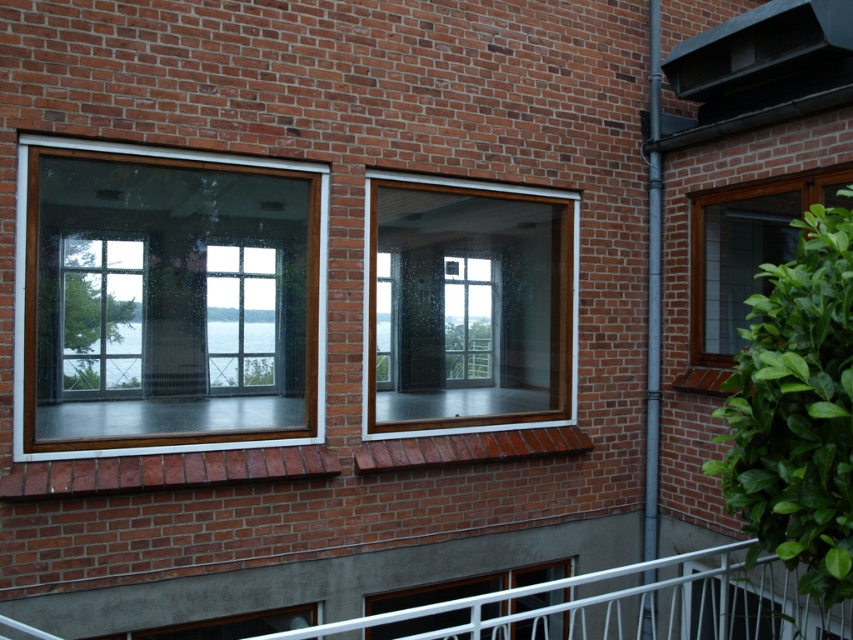
Question: Which point is farther to the camera?

Choices:
 (A) (805, 598)
 (B) (280, 372)

Answer: (B)

Question: Which of the following is the farthest from the observer?

Choices:
 (A) (747, 241)
 (B) (473, 577)

Answer: (A)

Question: Considering the relative positions of clear glass window at left and clear glass window at center in the image provided, where is clear glass window at left located with respect to clear glass window at center?

Choices:
 (A) right
 (B) left

Answer: (B)

Question: Which point appears farthest from the camera in this image?

Choices:
 (A) (527, 284)
 (B) (566, 598)
 (C) (148, 429)
 (D) (503, 611)

Answer: (A)

Question: Can you confirm if clear glass window at center is positioned below clear glass window at lower center?

Choices:
 (A) yes
 (B) no

Answer: (B)

Question: Does white metal railing at lower center appear under clear glass window at lower center?

Choices:
 (A) yes
 (B) no

Answer: (B)